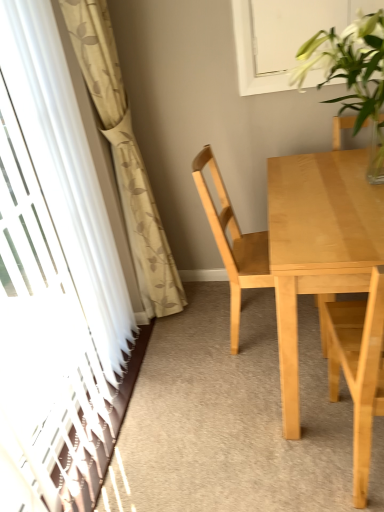
In order to click on vacant position to the left of light wood chair at center, which is the second chair from front to back in this screenshot , I will do `click(198, 367)`.